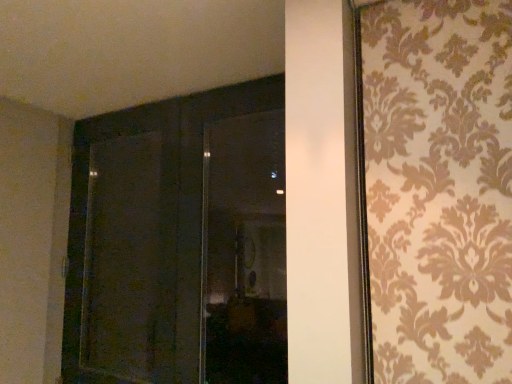
Question: Can you confirm if dark wood door at center is positioned to the left of transparent glass window at center?

Choices:
 (A) yes
 (B) no

Answer: (A)

Question: From a real-world perspective, is dark wood door at center on transparent glass window at center?

Choices:
 (A) yes
 (B) no

Answer: (B)

Question: From the image's perspective, is dark wood door at center on transparent glass window at center?

Choices:
 (A) yes
 (B) no

Answer: (B)

Question: Can you confirm if dark wood door at center is wider than transparent glass window at center?

Choices:
 (A) yes
 (B) no

Answer: (A)

Question: From a real-world perspective, is dark wood door at center below transparent glass window at center?

Choices:
 (A) yes
 (B) no

Answer: (A)

Question: From the image's perspective, is matte dark wood screen door at left located above or below transparent glass window at center?

Choices:
 (A) below
 (B) above

Answer: (A)

Question: Considering the relative positions of matte dark wood screen door at left and transparent glass window at center in the image provided, is matte dark wood screen door at left to the left or to the right of transparent glass window at center?

Choices:
 (A) right
 (B) left

Answer: (B)

Question: Looking at their shapes, would you say matte dark wood screen door at left is wider or thinner than transparent glass window at center?

Choices:
 (A) thin
 (B) wide

Answer: (B)

Question: Is matte dark wood screen door at left in front of or behind transparent glass window at center in the image?

Choices:
 (A) behind
 (B) front

Answer: (A)

Question: Considering their positions, is transparent glass window at center located in front of or behind dark wood door at center?

Choices:
 (A) behind
 (B) front

Answer: (A)

Question: From the image's perspective, relative to dark wood door at center, is transparent glass window at center above or below?

Choices:
 (A) above
 (B) below

Answer: (A)

Question: From a real-world perspective, is transparent glass window at center physically located above or below dark wood door at center?

Choices:
 (A) above
 (B) below

Answer: (A)

Question: Do you think transparent glass window at center is within dark wood door at center, or outside of it?

Choices:
 (A) outside
 (B) inside

Answer: (B)

Question: Is transparent glass window at center wider or thinner than matte dark wood screen door at left?

Choices:
 (A) thin
 (B) wide

Answer: (A)

Question: Is transparent glass window at center taller or shorter than matte dark wood screen door at left?

Choices:
 (A) short
 (B) tall

Answer: (A)